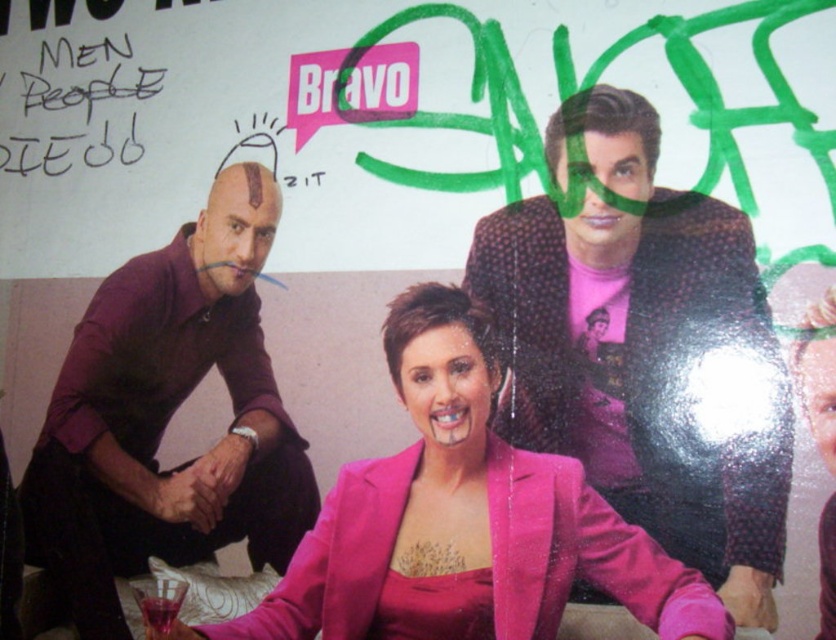
Is pink satin blazer at center to the right of black handwritten text at upper left from the viewer's perspective?

Yes, pink satin blazer at center is to the right of black handwritten text at upper left.

Which of these two, pink satin blazer at center or black handwritten text at upper left, stands shorter?

black handwritten text at upper left

Is point (421, 369) more distant than point (47, 100)?

That is False.

Where is `pink satin blazer at center`? pink satin blazer at center is located at coordinates (462, 520).

Is pink satin blazer at center shorter than purple matte shirt at left?

Correct, pink satin blazer at center is not as tall as purple matte shirt at left.

Does point (624, 534) come in front of point (84, 556)?

Yes.

Who is more forward, (385,513) or (90,400)?

Point (385,513) is more forward.

At what (x,y) coordinates should I click in order to perform the action: click on pink satin blazer at center. Please return your answer as a coordinate pair (x, y). The image size is (836, 640). Looking at the image, I should click on (462, 520).

Who is positioned more to the left, purple matte shirt at left or black handwritten text at upper left?

From the viewer's perspective, black handwritten text at upper left appears more on the left side.

Measure the distance between point (222,173) and camera.

Point (222,173) and camera are 2.46 meters apart.

Image resolution: width=836 pixels, height=640 pixels. Identify the location of purple matte shirt at left. (167, 417).

This screenshot has height=640, width=836. Identify the location of purple matte shirt at left. [x=167, y=417].